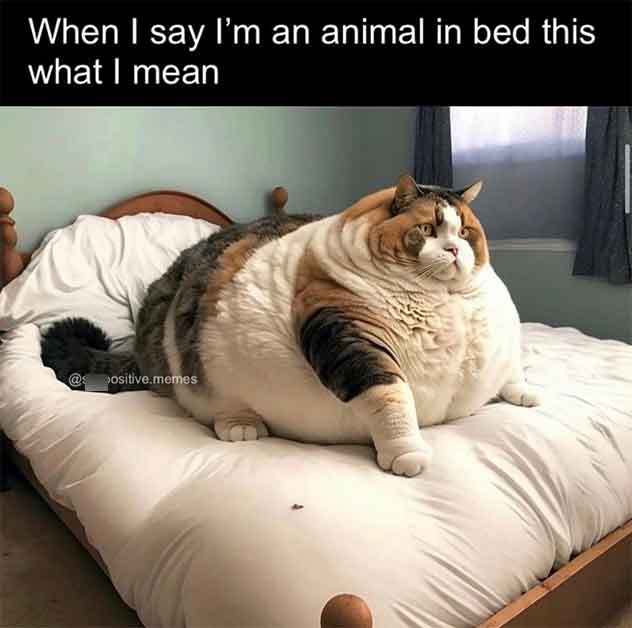
Locate an element on the screen. This screenshot has height=628, width=632. footboard is located at coordinates (351, 615), (566, 595).